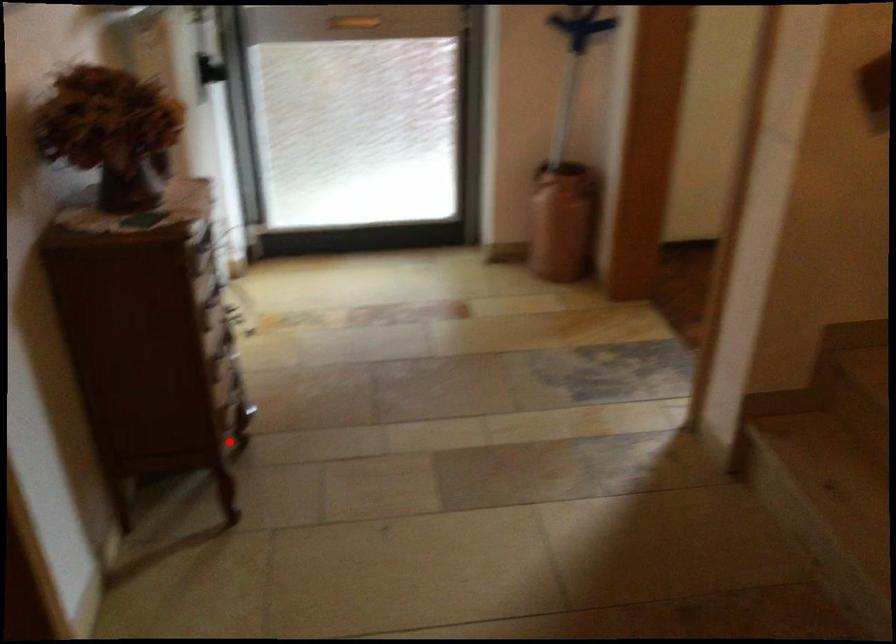
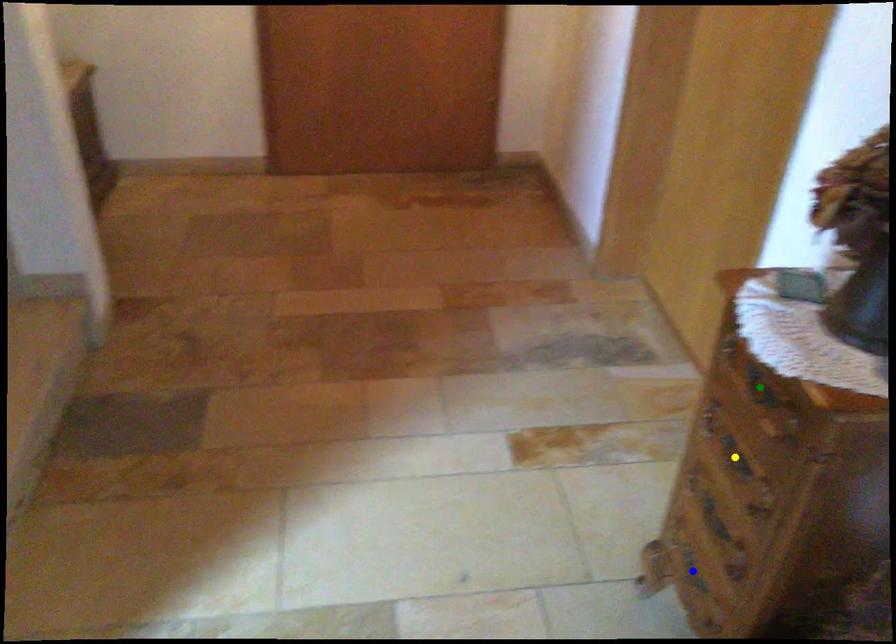
Question: I am providing you with two images of the same scene from different viewpoints. A red point is marked on the first image. You are given multiple points on the second image. Can you choose the point in image 2 that corresponds to the point in image 1?

Choices:
 (A) blue point
 (B) green point
 (C) yellow point

Answer: (A)